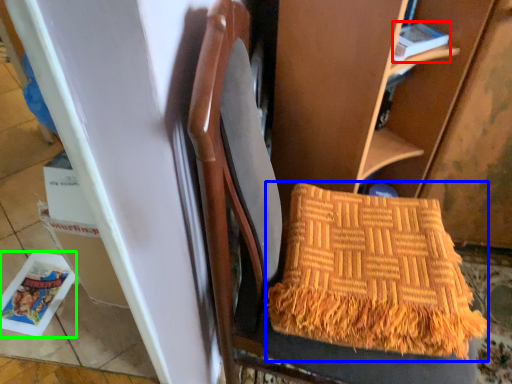
Question: Estimate the real-world distances between objects in this image. Which object is farther from magazine (highlighted by a red box), blanket (highlighted by a blue box) or magazine (highlighted by a green box)?

Choices:
 (A) blanket
 (B) magazine

Answer: (B)